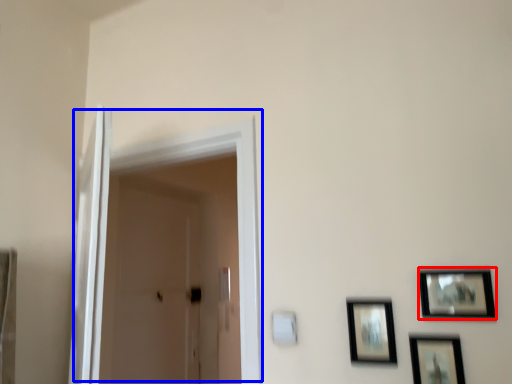
Question: Which of the following is the closest to the observer, picture frame (highlighted by a red box) or door (highlighted by a blue box)?

Choices:
 (A) picture frame
 (B) door

Answer: (A)